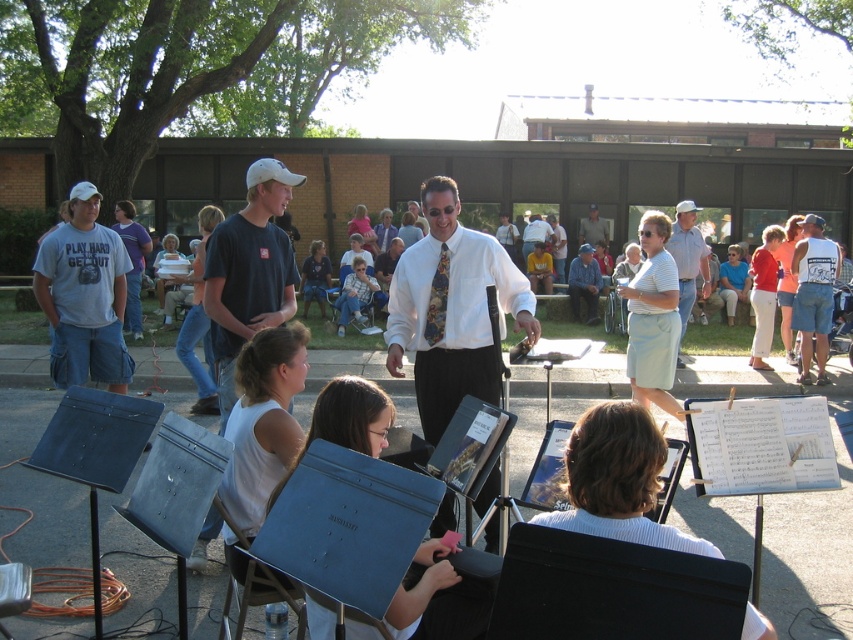
Between white silk shirt at center and white shirt at center, which one has less height?

Standing shorter between the two is white silk shirt at center.

Who is higher up, white silk shirt at center or white shirt at center?

Positioned higher is white shirt at center.

The width and height of the screenshot is (853, 640). Find the location of `white silk shirt at center`. white silk shirt at center is located at coordinates (451, 308).

At what (x,y) coordinates should I click in order to perform the action: click on white silk shirt at center. Please return your answer as a coordinate pair (x, y). This screenshot has width=853, height=640. Looking at the image, I should click on (451, 308).

Can you confirm if white silk shirt at center is thinner than gray cotton t-shirt at left?

No, white silk shirt at center is not thinner than gray cotton t-shirt at left.

In the scene shown: Is white silk shirt at center smaller than gray cotton t-shirt at left?

Indeed, white silk shirt at center has a smaller size compared to gray cotton t-shirt at left.

Does point (440, 525) come in front of point (53, 339)?

Yes, it is.

Where is `white silk shirt at center`? white silk shirt at center is located at coordinates (451, 308).

Which is above, gray cotton t-shirt at left or light blue shirt at center?

Positioned higher is light blue shirt at center.

Can you confirm if gray cotton t-shirt at left is positioned above light blue shirt at center?

Incorrect, gray cotton t-shirt at left is not positioned above light blue shirt at center.

Between point (105, 285) and point (592, 225), which one is positioned in front?

Point (105, 285) is in front.

Identify the location of gray cotton t-shirt at left. This screenshot has height=640, width=853. (84, 296).